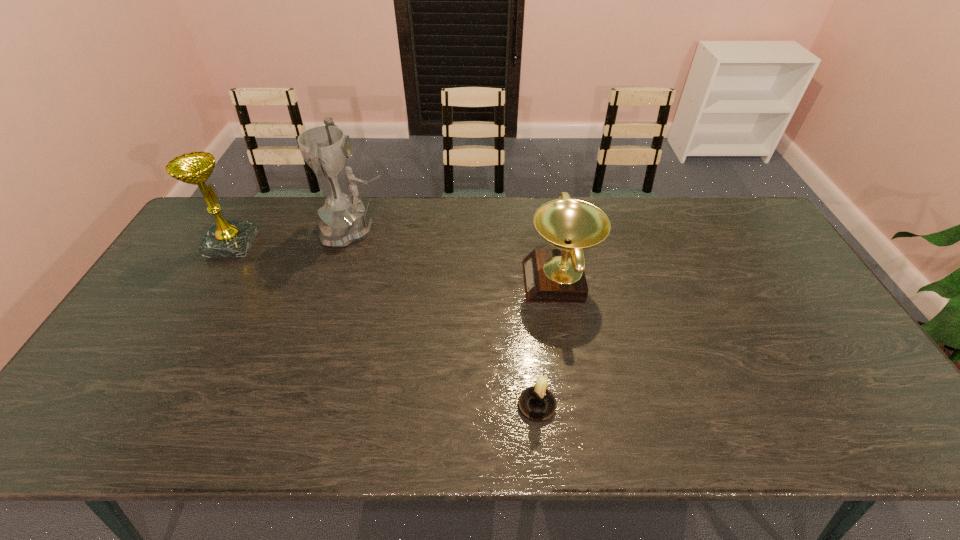
In the image, there is a desktop. At what (x,y) coordinates should I click in order to perform the action: click on free region at the right edge. Please return your answer as a coordinate pair (x, y). Looking at the image, I should click on tap(772, 293).

This screenshot has height=540, width=960. In order to click on blank space at the far left corner of the desktop in this screenshot , I will do `click(235, 200)`.

Identify the location of free region at the near right corner. (905, 433).

Identify the location of blank region between the second shortest award and the second award from left to right. (295, 237).

The image size is (960, 540). Identify the location of empty location between the third tallest object and the tallest object. (458, 255).

Find the location of `vacant point located between the second shortest object and the second tallest award`. vacant point located between the second shortest object and the second tallest award is located at coordinates (396, 262).

Locate an element on the screen. This screenshot has width=960, height=540. empty space between the leftmost award and the second shortest object is located at coordinates (396, 262).

Where is `free space that is in between the shortest award and the leftmost object`? free space that is in between the shortest award and the leftmost object is located at coordinates coord(396,262).

Identify the location of free space between the shortest object and the second tallest object. (385, 325).

Identify the location of empty space between the second object from left to right and the shortest object. (447, 318).